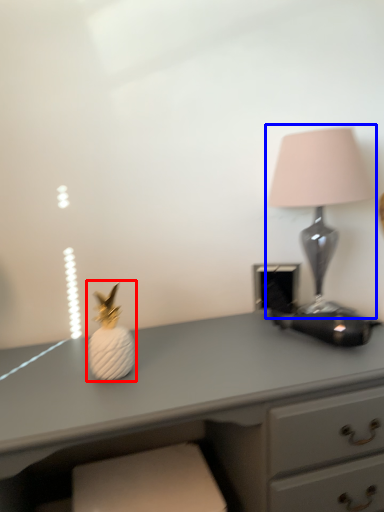
Question: Which object is further to the camera taking this photo, miniature (highlighted by a red box) or lamp (highlighted by a blue box)?

Choices:
 (A) miniature
 (B) lamp

Answer: (B)